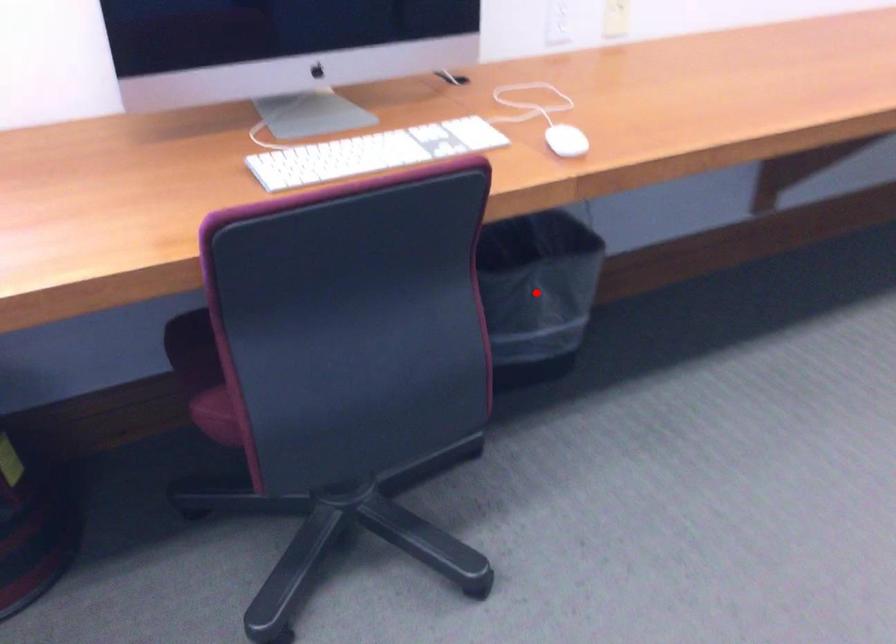
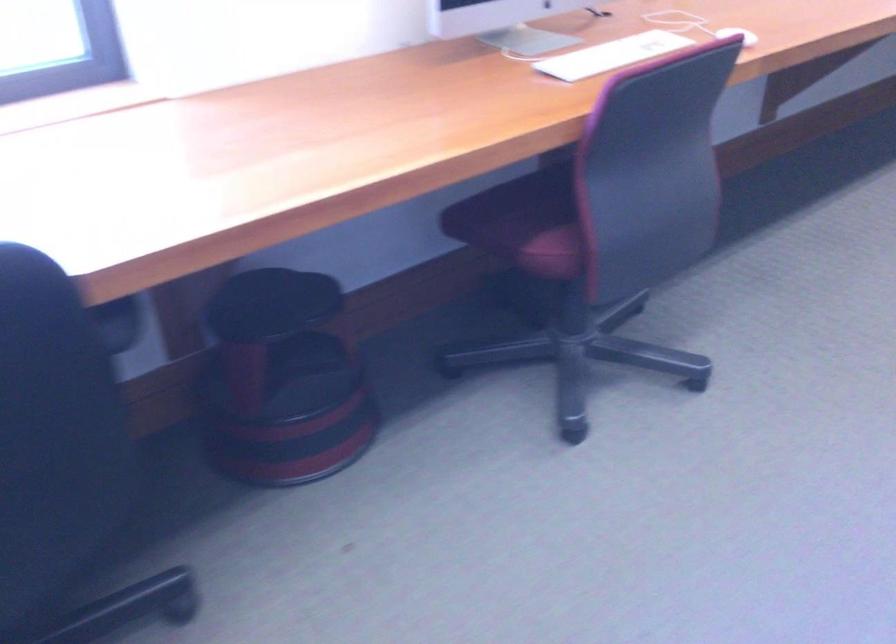
Question: I am providing you with two images of the same scene from different viewpoints. A red point is marked on the first image. Can you still see the location of the red point in image 2?

Choices:
 (A) Yes
 (B) No

Answer: (B)